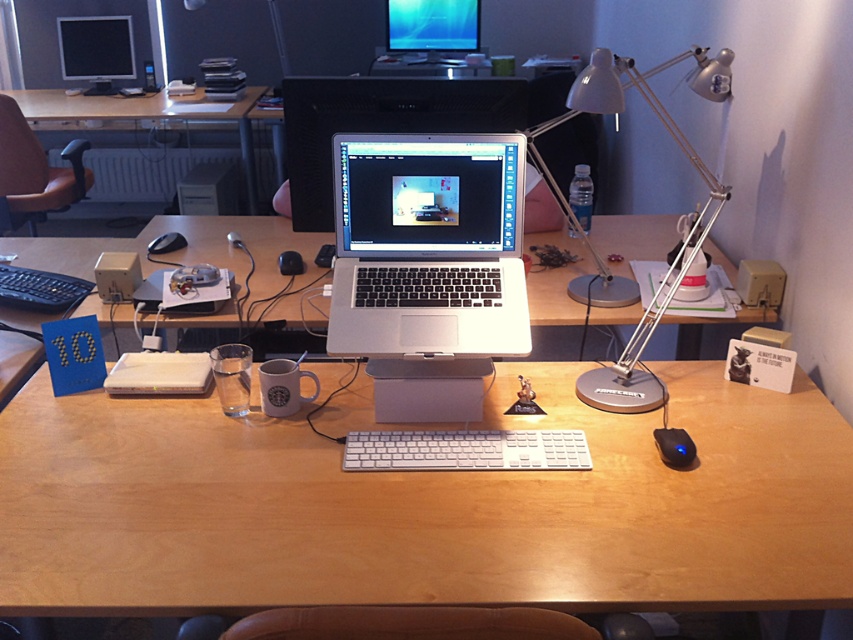
You are standing in front of the desk and want to place a new item on the wooden table at upper left. What are the coordinates where you should place it?

The wooden table at upper left is located at coordinates point (144, 116), so place the new item there.

You are a delivery person who needs to place a package that measures 20 inches in length between the wooden table at upper left and the brown leather chair at left. Can the package fit in the space between them?

The wooden table at upper left and the brown leather chair at left are 20.21 inches apart from each other. Since the package is 20 inches long, it can fit in the space between them as the distance is slightly larger than the package length.